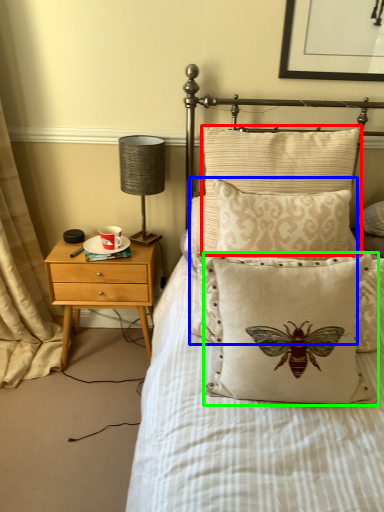
Question: Which object is positioned closest to pillow (highlighted by a red box)? Select from pillow (highlighted by a blue box) and pillow (highlighted by a green box).

Choices:
 (A) pillow
 (B) pillow

Answer: (A)